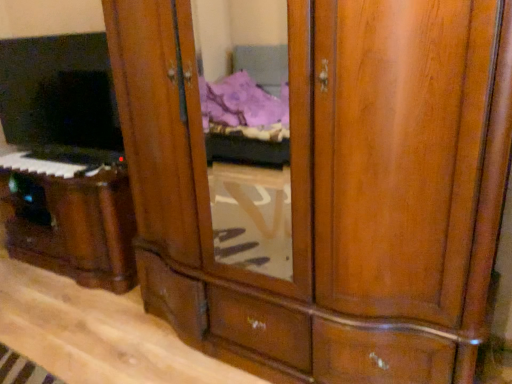
Question: Is matte black keyboard at left touching matte black tv at left?

Choices:
 (A) no
 (B) yes

Answer: (A)

Question: From a real-world perspective, does matte black keyboard at left stand above matte black tv at left?

Choices:
 (A) no
 (B) yes

Answer: (A)

Question: Does matte black keyboard at left have a smaller size compared to matte black tv at left?

Choices:
 (A) no
 (B) yes

Answer: (B)

Question: Is matte black keyboard at left shorter than matte black tv at left?

Choices:
 (A) yes
 (B) no

Answer: (A)

Question: Is matte black keyboard at left thinner than matte black tv at left?

Choices:
 (A) yes
 (B) no

Answer: (B)

Question: From the image's perspective, is matte black keyboard at left beneath matte black tv at left?

Choices:
 (A) no
 (B) yes

Answer: (B)

Question: Is wooden piano at lower left looking in the opposite direction of matte black tv at left?

Choices:
 (A) yes
 (B) no

Answer: (B)

Question: From a real-world perspective, does wooden piano at lower left stand above matte black tv at left?

Choices:
 (A) yes
 (B) no

Answer: (B)

Question: Does wooden piano at lower left appear on the right side of matte black tv at left?

Choices:
 (A) no
 (B) yes

Answer: (B)

Question: Does wooden piano at lower left contain matte black tv at left?

Choices:
 (A) yes
 (B) no

Answer: (B)

Question: Is wooden piano at lower left thinner than matte black tv at left?

Choices:
 (A) no
 (B) yes

Answer: (A)

Question: Does wooden piano at lower left have a lesser height compared to matte black tv at left?

Choices:
 (A) no
 (B) yes

Answer: (B)

Question: Does matte black tv at left have a smaller size compared to matte black keyboard at left?

Choices:
 (A) no
 (B) yes

Answer: (A)